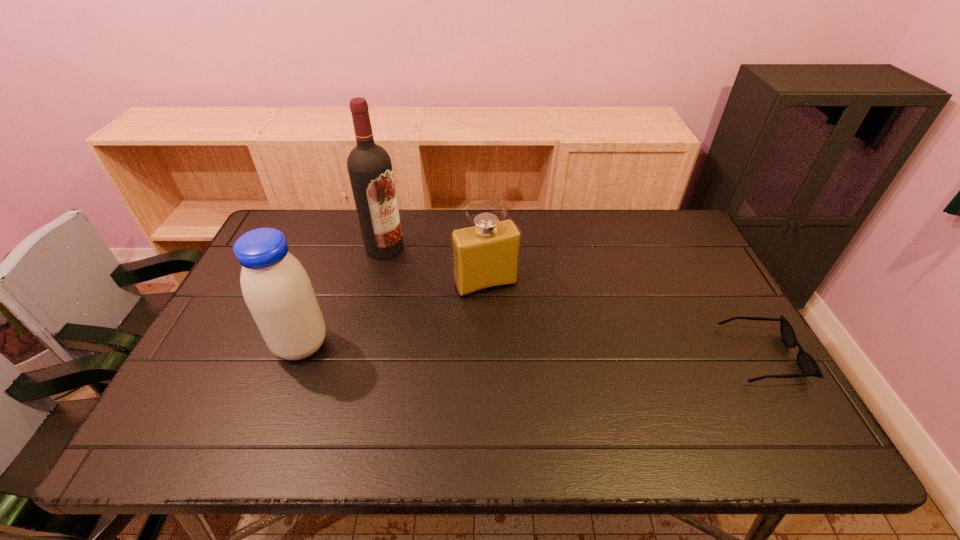
What are the coordinates of `vacant space that's between the second object from right to left and the tallest object` in the screenshot? It's located at (435, 266).

Where is `vacant space in between the second object from left to right and the second object from right to left`? The height and width of the screenshot is (540, 960). vacant space in between the second object from left to right and the second object from right to left is located at coordinates (435, 266).

Locate an element on the screen. This screenshot has width=960, height=540. free point between the third object from left to right and the farthest object is located at coordinates (435, 266).

Locate an element on the screen. The width and height of the screenshot is (960, 540). vacant area that lies between the second shortest object and the third object from right to left is located at coordinates (435, 266).

I want to click on object that is the second closest to the farthest object, so click(277, 290).

Identify which object is the second nearest to the rightmost object. Please provide its 2D coordinates. Your answer should be formatted as a tuple, i.e. [(x, y)], where the tuple contains the x and y coordinates of a point satisfying the conditions above.

[(369, 166)]

In order to click on free space that satisfies the following two spatial constraints: 1. on the back side of the tallest object; 2. on the right side of the leftmost object in this screenshot , I will do `click(338, 247)`.

What are the coordinates of `vacant space that satisfies the following two spatial constraints: 1. on the front side of the second shortest object; 2. on the right side of the wine bottle` in the screenshot? It's located at (375, 284).

Locate an element on the screen. This screenshot has height=540, width=960. vacant point that satisfies the following two spatial constraints: 1. on the back side of the soya milk; 2. on the right side of the third object from right to left is located at coordinates (338, 247).